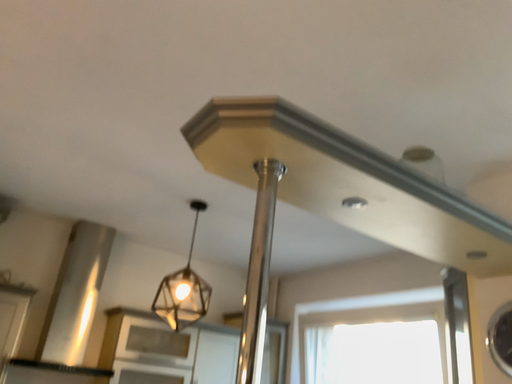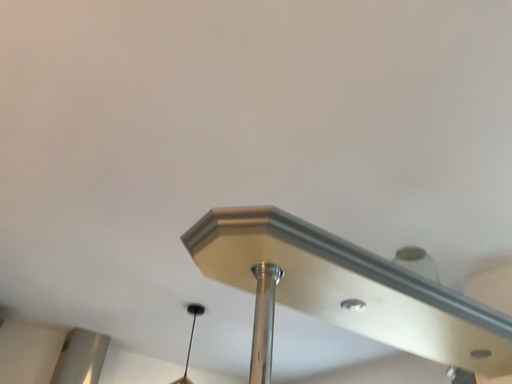
Question: How did the camera likely rotate when shooting the video?

Choices:
 (A) rotated upward
 (B) rotated downward

Answer: (A)